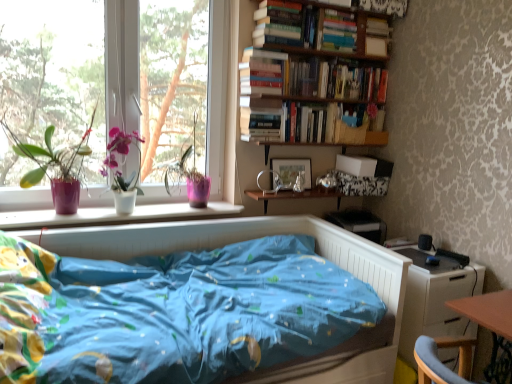
Question: Based on their sizes in the image, would you say white glossy dresser at lower right is bigger or smaller than matte wooden picture frame at center?

Choices:
 (A) small
 (B) big

Answer: (B)

Question: In the image, is white glossy dresser at lower right positioned in front of or behind matte wooden picture frame at center?

Choices:
 (A) front
 (B) behind

Answer: (A)

Question: Estimate the real-world distances between objects in this image. Which object is farther from the white glossy vase at left, the second window screen viewed from the left?

Choices:
 (A) matte purple pot at left
 (B) hardcover books at upper right, positioned as the 3th book in bottom-to-top order
 (C) matte wooden picture frame at center
 (D) pink plastic pot at window
 (E) wooden shelf at center, which is the first shelf in bottom-to-top order

Answer: (E)

Question: Which is farther from the pink plastic pot at window?

Choices:
 (A) wooden shelf at center, which is the first shelf in bottom-to-top order
 (B) transparent glass window at upper left
 (C) blue fabric bed at center
 (D) hardcover books at upper center, the 1th book ordered from the bottom
 (E) matte wooden picture frame at center

Answer: (D)